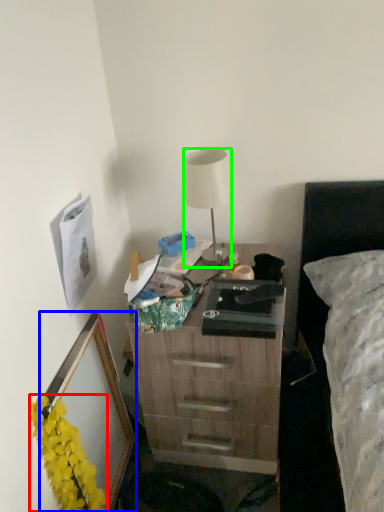
Question: Estimate the real-world distances between objects in this image. Which object is farther from flower (highlighted by a red box), picture frame (highlighted by a blue box) or lamp (highlighted by a green box)?

Choices:
 (A) picture frame
 (B) lamp

Answer: (B)